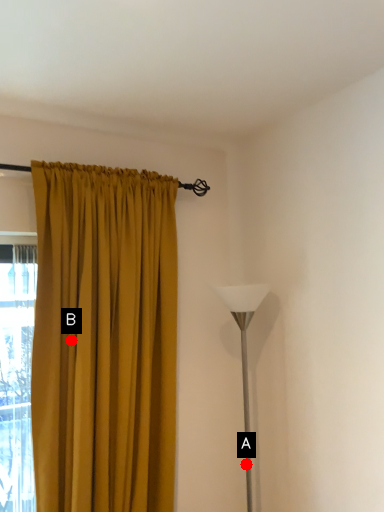
Question: Two points are circled on the image, labeled by A and B beside each circle. Which point appears farthest from the camera in this image?

Choices:
 (A) A is further
 (B) B is further

Answer: (A)